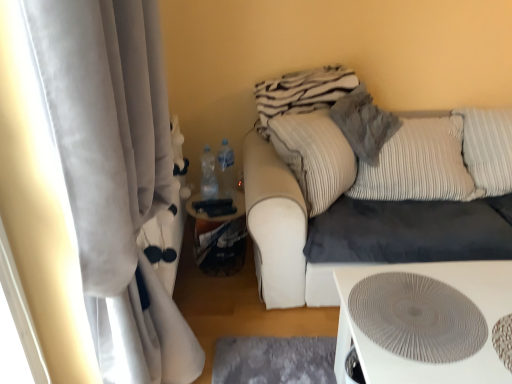
Question: Is textured gray pillow at upper right, the first pillow from the left, in contact with white textured table at lower right?

Choices:
 (A) yes
 (B) no

Answer: (B)

Question: From a real-world perspective, is textured gray pillow at upper right, which is counted as the 2th pillow, starting from the right, under white textured table at lower right?

Choices:
 (A) yes
 (B) no

Answer: (B)

Question: Is textured gray pillow at upper right, which is counted as the 2th pillow, starting from the right, located outside white textured table at lower right?

Choices:
 (A) no
 (B) yes

Answer: (B)

Question: From the image's perspective, would you say textured gray pillow at upper right, which is counted as the 2th pillow, starting from the right, is positioned over white textured table at lower right?

Choices:
 (A) no
 (B) yes

Answer: (B)

Question: Is textured gray pillow at upper right, the first pillow from the left, at the left side of white textured table at lower right?

Choices:
 (A) yes
 (B) no

Answer: (A)

Question: Based on their sizes in the image, would you say velvet beige couch at center is bigger or smaller than striped fabric pillow at upper right, acting as the second pillow starting from the left?

Choices:
 (A) small
 (B) big

Answer: (B)

Question: Is velvet beige couch at center to the left or to the right of striped fabric pillow at upper right, the 1th pillow when ordered from right to left, in the image?

Choices:
 (A) left
 (B) right

Answer: (A)

Question: Would you say velvet beige couch at center is inside or outside striped fabric pillow at upper right, the 1th pillow when ordered from right to left?

Choices:
 (A) inside
 (B) outside

Answer: (B)

Question: From the image's perspective, is velvet beige couch at center located above or below striped fabric pillow at upper right, the 1th pillow when ordered from right to left?

Choices:
 (A) below
 (B) above

Answer: (A)

Question: Visually, is white textured table at lower right positioned to the left or to the right of striped fabric pillow at upper right, acting as the second pillow starting from the left?

Choices:
 (A) right
 (B) left

Answer: (B)

Question: Does point (510, 289) appear closer or farther from the camera than point (397, 162)?

Choices:
 (A) closer
 (B) farther

Answer: (A)

Question: In the image, is white textured table at lower right positioned in front of or behind striped fabric pillow at upper right, acting as the second pillow starting from the left?

Choices:
 (A) front
 (B) behind

Answer: (A)

Question: From a real-world perspective, is white textured table at lower right positioned above or below striped fabric pillow at upper right, acting as the second pillow starting from the left?

Choices:
 (A) above
 (B) below

Answer: (B)

Question: Is velvet beige couch at center in front of or behind white velvet curtain at left in the image?

Choices:
 (A) front
 (B) behind

Answer: (B)

Question: From their relative heights in the image, would you say velvet beige couch at center is taller or shorter than white velvet curtain at left?

Choices:
 (A) short
 (B) tall

Answer: (A)